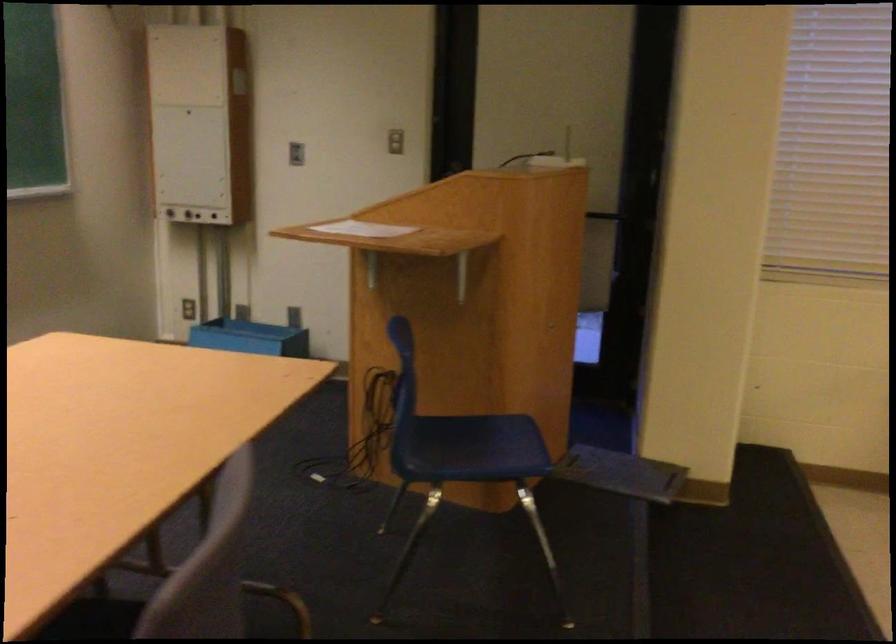
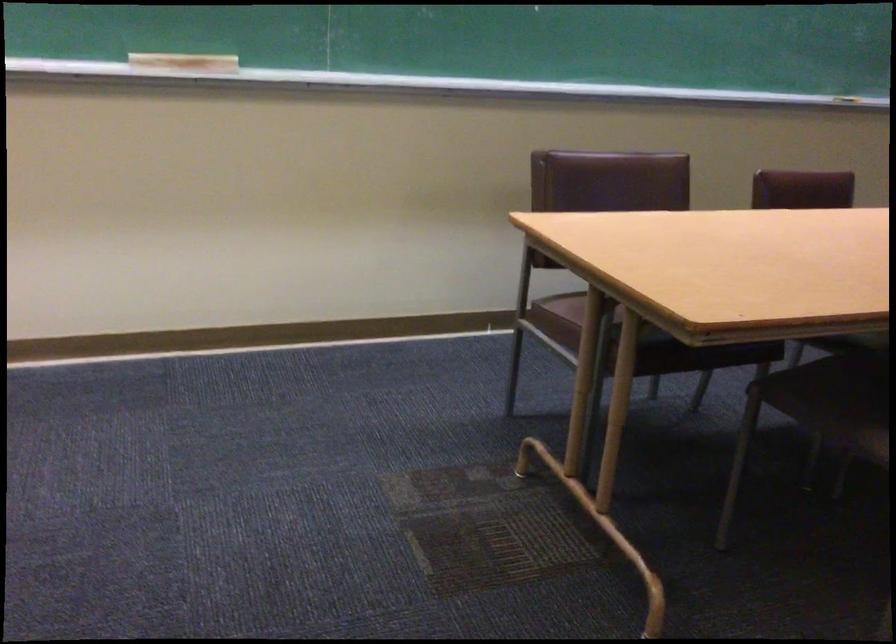
Question: Based on the continuous images, in which direction is the camera rotating? Reply with the corresponding letter.

Choices:
 (A) Left
 (B) Right
 (C) Up
 (D) Down

Answer: (A)